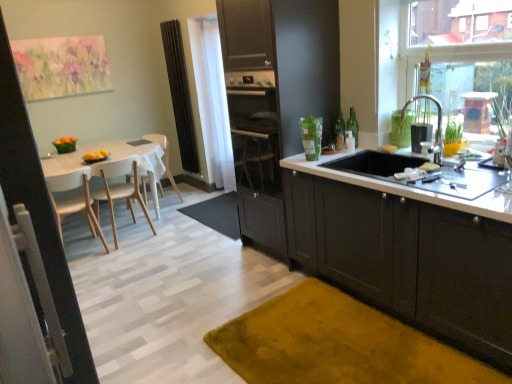
Identify the location of free spot above mustard yellow carpet at lower right, the second doormat in the top-to-bottom sequence (from a real-world perspective). (341, 344).